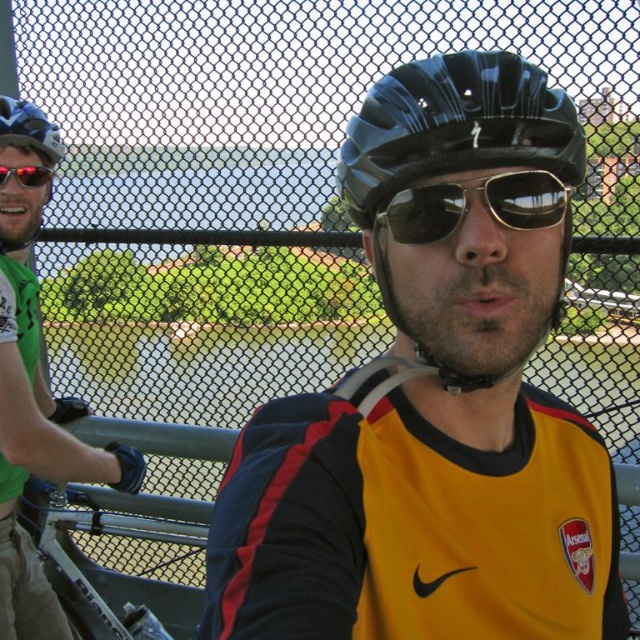
You are a drone operator trying to capture a photo of the cyclists on the bridge. To ensure safety, you need to keep the drone above the metallic gray rail at center. What is the 2D coordinate point you should aim for?

The 2D coordinate point for the metallic gray rail at center is at point (x=118, y=596). You should aim the drone above this point to ensure safety.

You are a photographer trying to capture the cyclist wearing the yellow sports jersey. You notice the sunglasses at center and the matte black helmet at left. Which object should you focus on to ensure it takes up more space in your photo?

The matte black helmet at left should be focused on because it occupies more space than the sunglasses at center.

You are a photographer who wants to capture both the matte black helmet at center and the matte black helmet at left in a single photo. Which helmet should you focus on first to ensure both are in frame, considering their sizes?

The matte black helmet at center is larger in size than the matte black helmet at left. Therefore, focus on the matte black helmet at center first to ensure both are in frame, as its larger size may require more attention to composition.